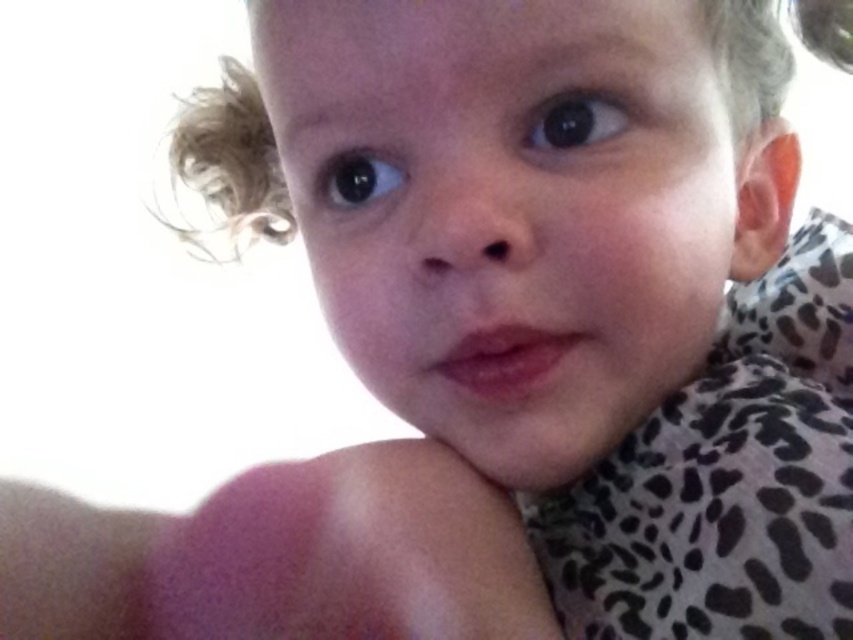
You are a photographer adjusting the lighting for a portrait. You notice the blonde curly hair at upper left and the black glossy eye at upper center in your frame. Which object should you adjust the light to highlight first if you want to ensure both are properly lit, considering their positions?

The blonde curly hair at upper left should be adjusted first because it is taller than the black glossy eye at upper center, so adjusting it first ensures proper lighting for both.

You are a photographer adjusting your camera settings to capture the perfect shot of the child. The camera has a focus range of 18 inches. Can you focus on the blonde curly hair at upper left without adjusting the focus distance?

The blonde curly hair at upper left is 18.10 inches from the viewer, so yes, the camera can focus on it since the distance is within the focus range of 18 inches.